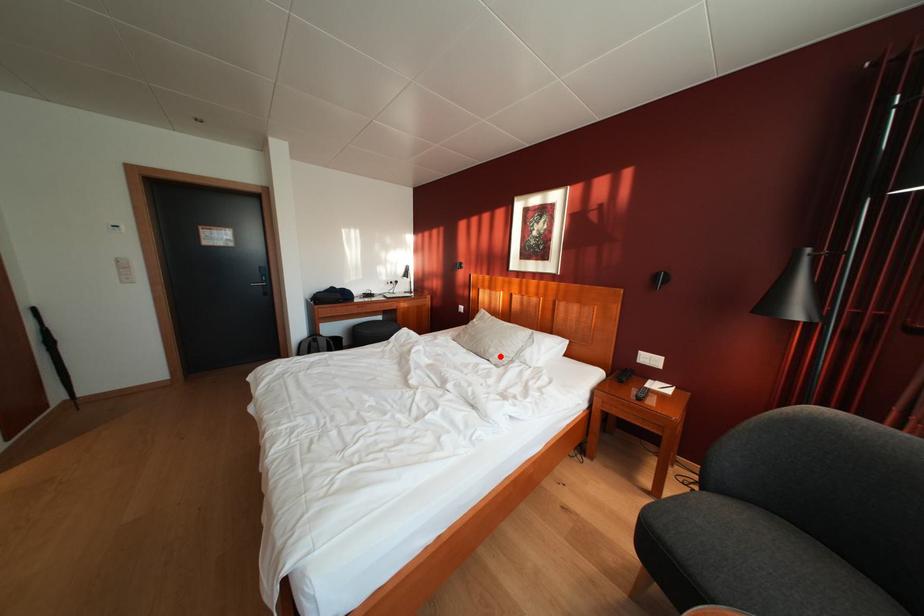
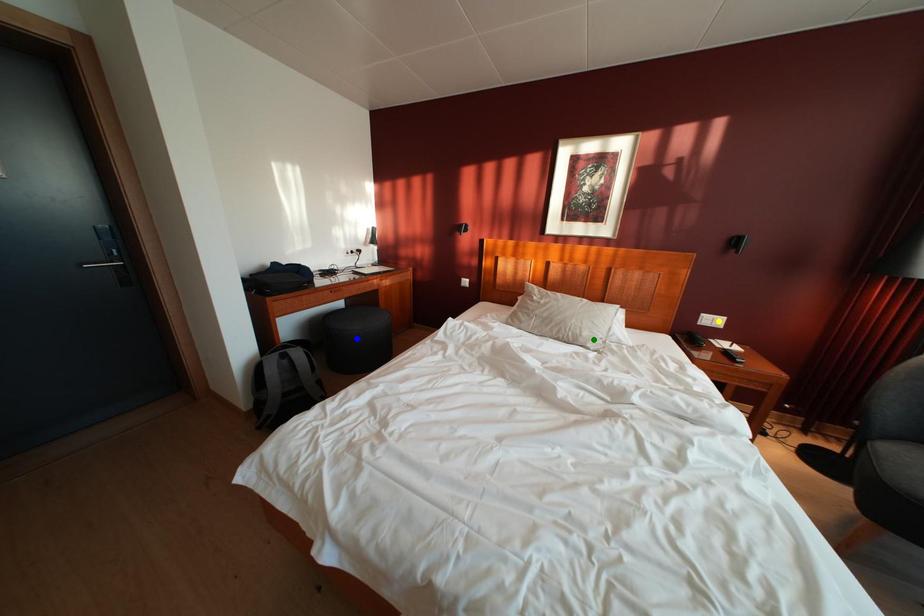
Question: I am providing you with two images of the same scene from different viewpoints. A red point is marked on the first image. You are given multiple points on the second image. Which mark in image 2 goes with the point in image 1?

Choices:
 (A) blue point
 (B) yellow point
 (C) green point

Answer: (C)